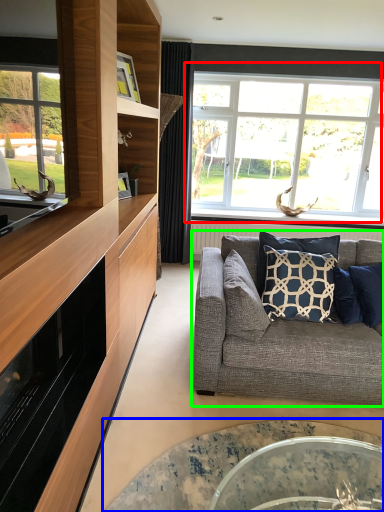
Question: Which is farther away from window (highlighted by a red box)? coffee table (highlighted by a blue box) or studio couch (highlighted by a green box)?

Choices:
 (A) coffee table
 (B) studio couch

Answer: (A)